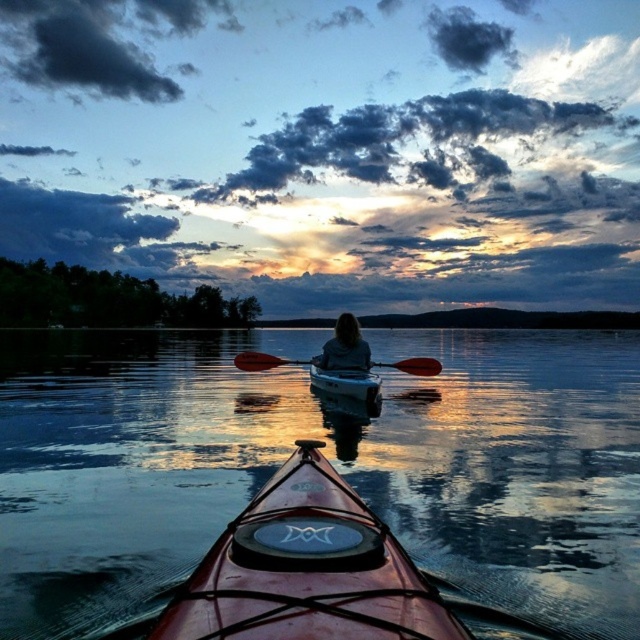
You are navigating a boat and need to dock at the shiny red canoe at center. Based on the coordinates provided, can you determine the direction you should head to reach it?

The shiny red canoe at center is located at point coordinates, so you should head towards the coordinates provided to reach it.

You are a photographer trying to capture the sunset scene. You notice the dark brown hair at center and the matte white canoe at center. Which object should you focus on if you want to highlight something taller in your composition?

The dark brown hair at center is taller than the matte white canoe at center, so focusing on it will highlight the taller object in your composition.